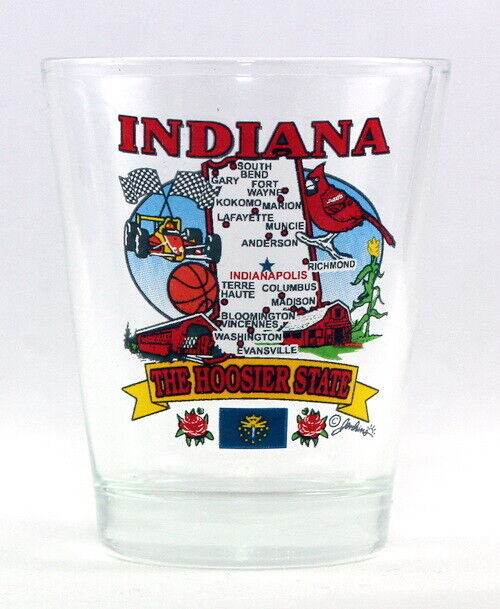
Locate an element on the screen. This screenshot has width=500, height=609. bottom of glass is located at coordinates (215, 532).